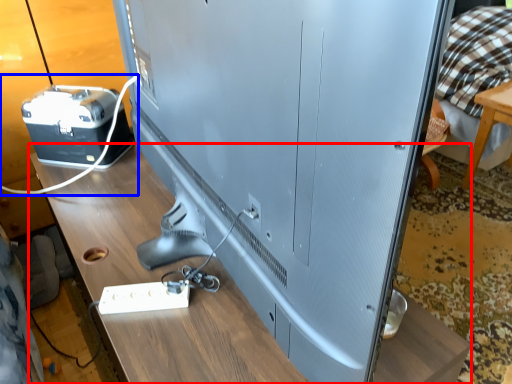
Question: Among these objects, which one is nearest to the camera, table (highlighted by a red box) or wire (highlighted by a blue box)?

Choices:
 (A) table
 (B) wire

Answer: (A)